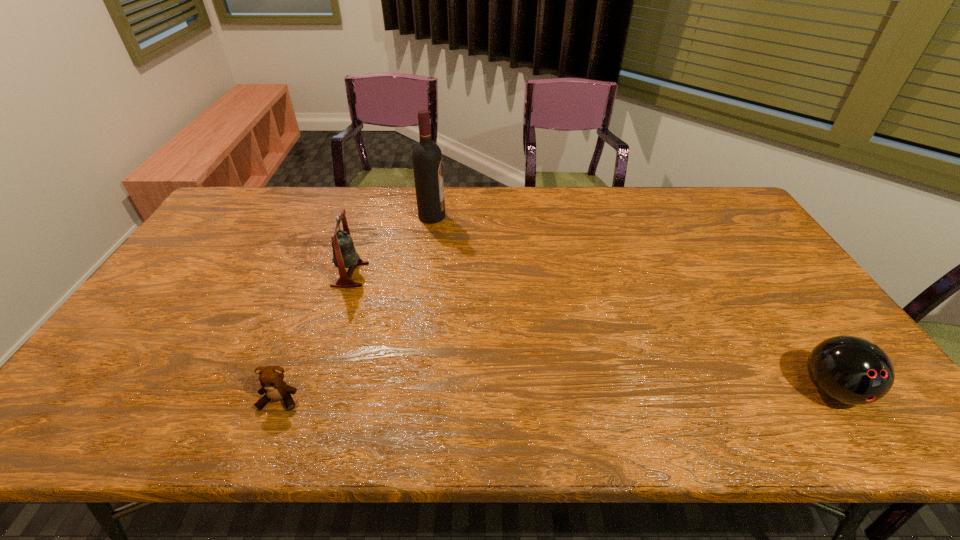
Identify the location of object that stands as the second closest to the rightmost object. (344, 254).

Where is `object that stands as the third closest to the bell`? object that stands as the third closest to the bell is located at coordinates (851, 370).

At what (x,y) coordinates should I click in order to perform the action: click on free space that satisfies the following two spatial constraints: 1. on the label of the farthest object; 2. on the front-facing side of the shortest object. Please return your answer as a coordinate pair (x, y). The height and width of the screenshot is (540, 960). Looking at the image, I should click on (406, 400).

You are a GUI agent. You are given a task and a screenshot of the screen. Output one action in this format:
    pyautogui.click(x=<x>, y=<y>)
    Task: Click on the free point that satisfies the following two spatial constraints: 1. on the label of the farthest object; 2. on the front-facing side of the shortest object
    This screenshot has width=960, height=540.
    Given the screenshot: What is the action you would take?
    pyautogui.click(x=406, y=400)

Locate an element on the screen. This screenshot has width=960, height=540. free space that satisfies the following two spatial constraints: 1. on the label of the third object from left to right; 2. on the front-facing side of the teddy bear is located at coordinates (406, 400).

In order to click on vacant region that satisfies the following two spatial constraints: 1. on the label of the farthest object; 2. on the front side of the third shortest object in this screenshot , I will do `click(423, 274)`.